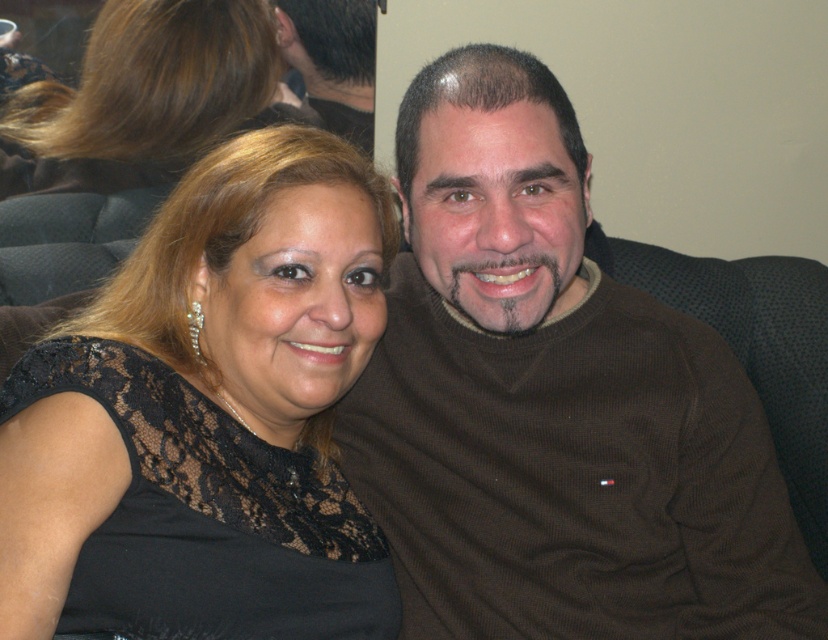
Can you confirm if brown sweater at center is wider than black lace dress at upper left?

Yes.

Is the position of brown sweater at center more distant than that of black lace dress at upper left?

Yes, it is.

Locate an element on the screen. Image resolution: width=828 pixels, height=640 pixels. brown sweater at center is located at coordinates (552, 403).

Identify the location of brown sweater at center. (552, 403).

Which of these two, black lace dress at upper left or dark brown hair at upper center, stands taller?

black lace dress at upper left is taller.

Where is `black lace dress at upper left`? The width and height of the screenshot is (828, 640). black lace dress at upper left is located at coordinates (213, 369).

Is black lace dress at upper left thinner than brown lace dress at upper left?

Yes.

Is black lace dress at upper left further to camera compared to brown lace dress at upper left?

No.

Is point (290, 512) farther from camera compared to point (177, 109)?

No, (290, 512) is in front of (177, 109).

This screenshot has height=640, width=828. In order to click on black lace dress at upper left in this screenshot , I will do `click(213, 369)`.